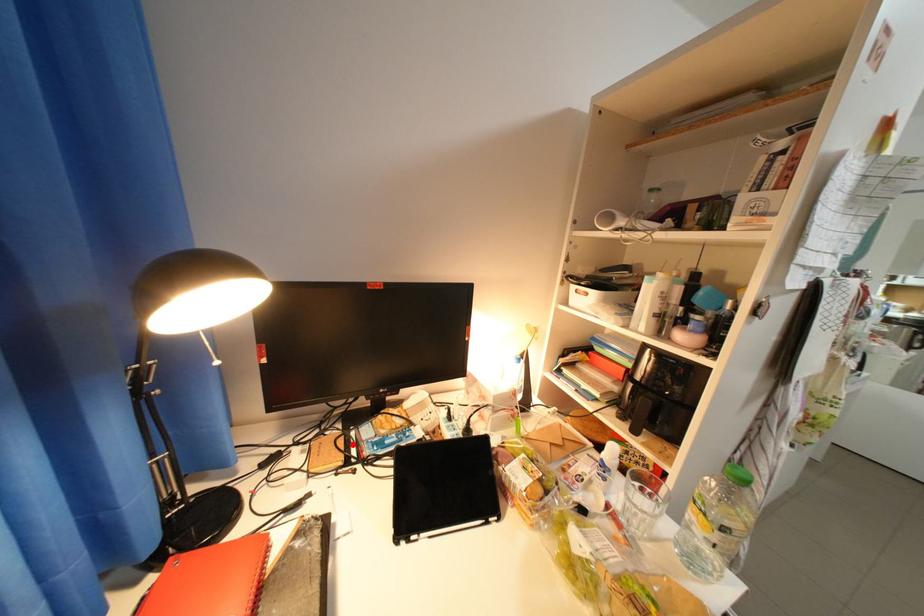
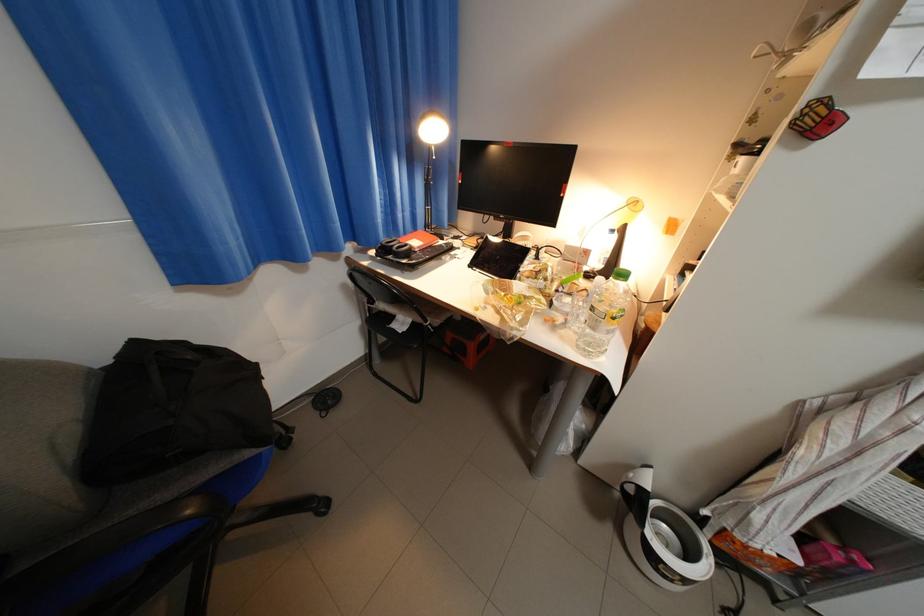
The point at the highlighted location is marked in the first image. Where is the corresponding point in the second image?

(492, 241)